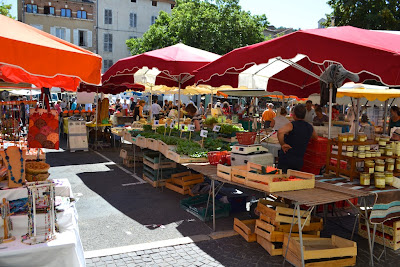
At what (x,y) coordinates should I click in order to perform the action: click on jars. Please return your answer as a coordinate pair (x, y). The width and height of the screenshot is (400, 267). Looking at the image, I should click on (365, 146), (376, 168), (380, 149), (342, 144).